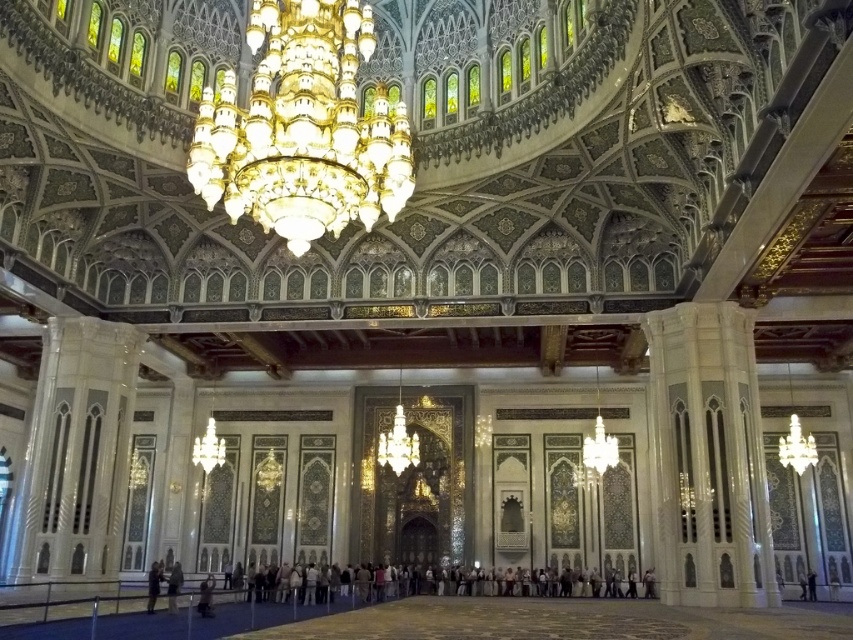
You are a visitor standing at the entrance of the mosque and want to take a photo of the gold crystal chandelier at upper center while standing near the dark blue jeans at lower center. Considering the distance between them, will you be able to capture the entire chandelier in your photo without moving closer?

The distance between the gold crystal chandelier at upper center and dark blue jeans at lower center is 134.54 feet. Since the chandelier is far away, you might need a zoom lens to capture it fully without moving closer.

You are standing in the grand mosque and want to locate the gold crystal chandelier at upper center. According to the coordinates provided, what are its exact coordinates?

The gold crystal chandelier at upper center is located at coordinates point (303, 128).

You are standing at the entrance of the mosque and see two points marked on the floor. The first point is at coordinates point (x=287, y=147) and the second is at point (x=149, y=572). Which point is closer to you as you face the entrance?

Point (x=287, y=147) is in front of point (x=149, y=572), so the first point is closer to you as you face the entrance.